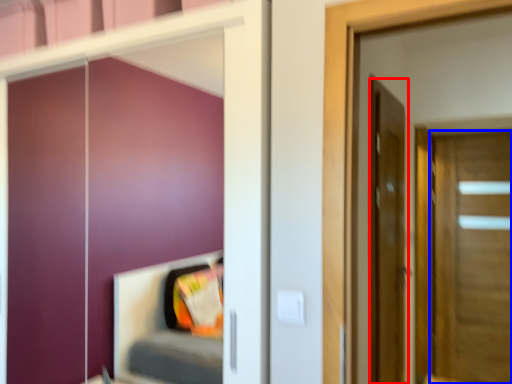
Question: Which of the following is the farthest to the observer, door (highlighted by a red box) or door (highlighted by a blue box)?

Choices:
 (A) door
 (B) door

Answer: (B)